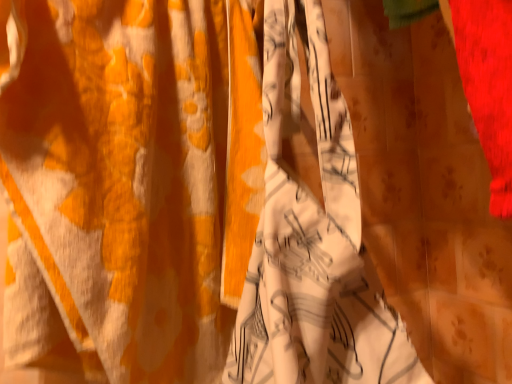
The height and width of the screenshot is (384, 512). I want to click on white printed fabric at center, so click(312, 240).

Describe the element at coordinates (312, 240) in the screenshot. This screenshot has width=512, height=384. I see `white printed fabric at center` at that location.

Where is `white printed fabric at center`? This screenshot has height=384, width=512. white printed fabric at center is located at coordinates (121, 183).

This screenshot has height=384, width=512. What do you see at coordinates (121, 183) in the screenshot? I see `white printed fabric at center` at bounding box center [121, 183].

Where is `white printed fabric at center`? white printed fabric at center is located at coordinates (312, 240).

Which object is positioned more to the right, white printed fabric at center or white printed fabric at center?

Positioned to the right is white printed fabric at center.

Considering their positions, is white printed fabric at center located in front of or behind white printed fabric at center?

Clearly, white printed fabric at center is in front of white printed fabric at center.

Does point (383, 325) lie behind point (88, 9)?

No.

From the image's perspective, who appears lower, white printed fabric at center or white printed fabric at center?

white printed fabric at center is shown below in the image.

From a real-world perspective, which object stands above the other?

From a 3D spatial view, white printed fabric at center is above.

In terms of width, does white printed fabric at center look wider or thinner when compared to white printed fabric at center?

white printed fabric at center is wider than white printed fabric at center.

Can you confirm if white printed fabric at center is shorter than white printed fabric at center?

Yes.

Is white printed fabric at center bigger or smaller than white printed fabric at center?

Clearly, white printed fabric at center is smaller in size than white printed fabric at center.

Is white printed fabric at center not inside white printed fabric at center?

Indeed, white printed fabric at center is completely outside white printed fabric at center.

Is white printed fabric at center next to white printed fabric at center?

There is a gap between white printed fabric at center and white printed fabric at center.

Is white printed fabric at center turned away from white printed fabric at center?

No, white printed fabric at center's orientation is not away from white printed fabric at center.

How much distance is there between white printed fabric at center and white printed fabric at center?

7.16 inches.

The width and height of the screenshot is (512, 384). In the image, there is a white printed fabric at center. What are the coordinates of `clothing below it (from a real-world perspective)` in the screenshot? It's located at (312, 240).

Would you say white printed fabric at center is to the left or to the right of white printed fabric at center in the picture?

Based on their positions, white printed fabric at center is located to the left of white printed fabric at center.

Relative to white printed fabric at center, is white printed fabric at center in front or behind?

white printed fabric at center is behind white printed fabric at center.

Considering the points (161, 154) and (347, 365), which point is in front, point (161, 154) or point (347, 365)?

Point (347, 365)

From the image's perspective, who appears lower, white printed fabric at center or white printed fabric at center?

white printed fabric at center.

From a real-world perspective, is white printed fabric at center physically below white printed fabric at center?

No, from a real-world perspective, white printed fabric at center is not under white printed fabric at center.

In the scene shown: Looking at their sizes, would you say white printed fabric at center is wider or thinner than white printed fabric at center?

white printed fabric at center is thinner than white printed fabric at center.

Does white printed fabric at center have a greater height compared to white printed fabric at center?

Yes, white printed fabric at center is taller than white printed fabric at center.

From the picture: Is white printed fabric at center smaller than white printed fabric at center?

Incorrect, white printed fabric at center is not smaller in size than white printed fabric at center.

Is white printed fabric at center a part of white printed fabric at center?

No, white printed fabric at center is not surrounded by white printed fabric at center.

Are white printed fabric at center and white printed fabric at center beside each other?

No, white printed fabric at center is not making contact with white printed fabric at center.

Is white printed fabric at center facing towards white printed fabric at center?

Yes, white printed fabric at center faces towards white printed fabric at center.

How different are the orientations of white printed fabric at center and white printed fabric at center in degrees?

white printed fabric at center and white printed fabric at center are facing 96.3 degrees away from each other.

In order to click on curtain above the white printed fabric at center (from a real-world perspective) in this screenshot , I will do `click(121, 183)`.

Find the location of a particular element. curtain behind the white printed fabric at center is located at coordinates (121, 183).

Locate an element on the screen. This screenshot has height=384, width=512. curtain that is above the white printed fabric at center (from a real-world perspective) is located at coordinates (121, 183).